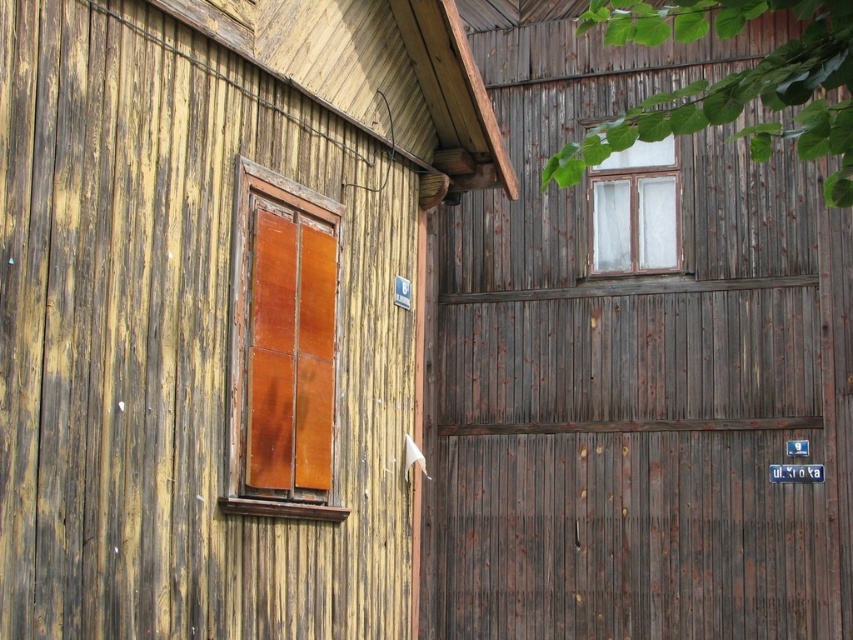
Question: Which object appears closest to the camera in this image?

Choices:
 (A) transparent glass window at upper center
 (B) wooden panel at left

Answer: (B)

Question: Is wooden panel at left positioned in front of transparent glass window at upper center?

Choices:
 (A) yes
 (B) no

Answer: (A)

Question: Which point is farther to the camera?

Choices:
 (A) (662, 157)
 (B) (265, 472)

Answer: (A)

Question: Does wooden panel at left appear under transparent glass window at upper center?

Choices:
 (A) yes
 (B) no

Answer: (A)

Question: Among these objects, which one is farthest from the camera?

Choices:
 (A) transparent glass window at upper center
 (B) wooden panel at left

Answer: (A)

Question: Where is wooden panel at left located in relation to transparent glass window at upper center in the image?

Choices:
 (A) left
 (B) right

Answer: (A)